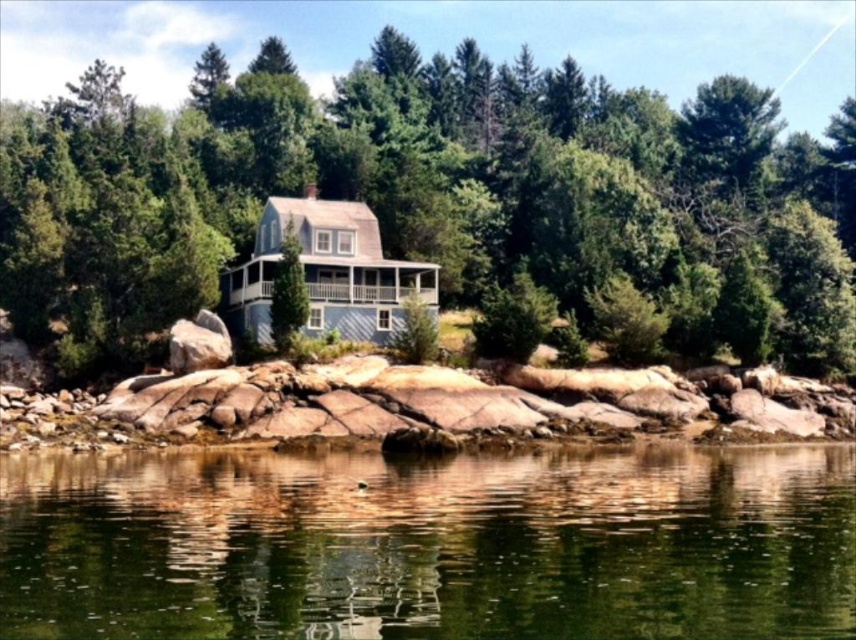
Does green reflective water at center have a larger size compared to brown rock at center?

Incorrect, green reflective water at center is not larger than brown rock at center.

Between green reflective water at center and brown rock at center, which one appears on the left side from the viewer's perspective?

brown rock at center is more to the left.

You are a GUI agent. You are given a task and a screenshot of the screen. Output one action in this format:
    pyautogui.click(x=<x>, y=<y>)
    Task: Click on the green reflective water at center
    
    Given the screenshot: What is the action you would take?
    pyautogui.click(x=431, y=545)

The width and height of the screenshot is (856, 640). Identify the location of green reflective water at center. (431, 545).

Is green textured tree at center wider than brown rock at center?

Yes.

Is green textured tree at center to the right of brown rock at center from the viewer's perspective?

No, green textured tree at center is not to the right of brown rock at center.

What do you see at coordinates (425, 195) in the screenshot? Image resolution: width=856 pixels, height=640 pixels. I see `green textured tree at center` at bounding box center [425, 195].

This screenshot has width=856, height=640. In order to click on green textured tree at center in this screenshot , I will do `click(425, 195)`.

Between green textured tree at center and green reflective water at center, which one has less height?

With less height is green reflective water at center.

Between green textured tree at center and green reflective water at center, which one appears on the left side from the viewer's perspective?

green textured tree at center

What do you see at coordinates (425, 195) in the screenshot? I see `green textured tree at center` at bounding box center [425, 195].

Locate an element on the screen. The width and height of the screenshot is (856, 640). green textured tree at center is located at coordinates [x=425, y=195].